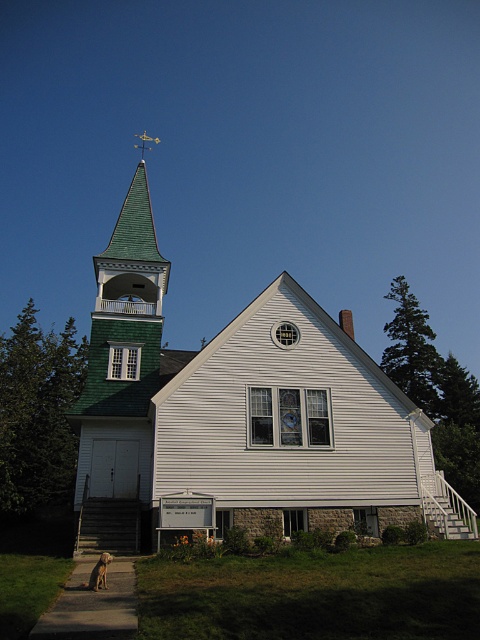
Question: Does white wood church steeple at upper left appear on the left side of gold/yellow metal cross at upper center?

Choices:
 (A) no
 (B) yes

Answer: (A)

Question: Which object appears closest to the camera in this image?

Choices:
 (A) white wood church steeple at upper left
 (B) brown fur dog at lower left
 (C) green shingles at upper left
 (D) gold/yellow metal cross at upper center

Answer: (B)

Question: Among these objects, which one is nearest to the camera?

Choices:
 (A) white wood church steeple at upper left
 (B) green shingles at upper left
 (C) brown fur dog at lower left
 (D) gold/yellow metal cross at upper center

Answer: (C)

Question: Which point is closer to the camera?

Choices:
 (A) white wood church steeple at upper left
 (B) gold/yellow metal cross at upper center
 (C) brown fur dog at lower left
 (D) green shingles at upper left

Answer: (C)

Question: Is brown fur dog at lower left to the left of gold/yellow metal cross at upper center from the viewer's perspective?

Choices:
 (A) no
 (B) yes

Answer: (A)

Question: Considering the relative positions of green shingles at upper left and brown fur dog at lower left in the image provided, where is green shingles at upper left located with respect to brown fur dog at lower left?

Choices:
 (A) right
 (B) left

Answer: (B)